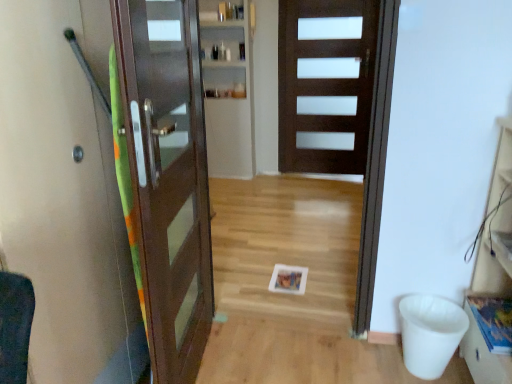
Question: Can you confirm if dark wood door at center, arranged as the 2th door when viewed from the left, is bigger than matte brown door at left, which is the 2th door in right-to-left order?

Choices:
 (A) yes
 (B) no

Answer: (A)

Question: Is dark wood door at center, positioned as the 1th door in right-to-left order, looking in the opposite direction of matte brown door at left, placed as the 1th door when sorted from left to right?

Choices:
 (A) yes
 (B) no

Answer: (B)

Question: Is matte brown door at left, placed as the second door when sorted from back to front, a part of dark wood door at center, positioned as the 1th door in right-to-left order?

Choices:
 (A) yes
 (B) no

Answer: (B)

Question: Can you confirm if dark wood door at center, arranged as the 2th door when viewed from the left, is taller than matte brown door at left, placed as the 1th door when sorted from left to right?

Choices:
 (A) yes
 (B) no

Answer: (A)

Question: Is dark wood door at center, positioned as the 1th door in right-to-left order, not inside matte brown door at left, which is counted as the first door, starting from the front?

Choices:
 (A) no
 (B) yes

Answer: (B)

Question: From their relative heights in the image, would you say dark wood door at center, acting as the first door starting from the back, is taller or shorter than green fabric elevator at left?

Choices:
 (A) tall
 (B) short

Answer: (A)

Question: From the image's perspective, relative to green fabric elevator at left, is dark wood door at center, arranged as the 2th door when viewed from the left, above or below?

Choices:
 (A) above
 (B) below

Answer: (A)

Question: From a real-world perspective, is dark wood door at center, placed as the 2th door when sorted from front to back, physically located above or below green fabric elevator at left?

Choices:
 (A) above
 (B) below

Answer: (A)

Question: Is dark wood door at center, placed as the 2th door when sorted from front to back, situated inside green fabric elevator at left or outside?

Choices:
 (A) outside
 (B) inside

Answer: (A)

Question: Relative to dark wood door at center, arranged as the 2th door when viewed from the left, is matte brown door at left, which is the 2th door in right-to-left order, in front or behind?

Choices:
 (A) front
 (B) behind

Answer: (A)

Question: From the image's perspective, is matte brown door at left, which is counted as the first door, starting from the front, above or below dark wood door at center, placed as the 2th door when sorted from front to back?

Choices:
 (A) above
 (B) below

Answer: (B)

Question: In terms of size, does matte brown door at left, which is counted as the first door, starting from the front, appear bigger or smaller than dark wood door at center, placed as the 2th door when sorted from front to back?

Choices:
 (A) big
 (B) small

Answer: (B)

Question: From a real-world perspective, is matte brown door at left, placed as the second door when sorted from back to front, positioned above or below dark wood door at center, positioned as the 1th door in right-to-left order?

Choices:
 (A) below
 (B) above

Answer: (A)

Question: Is point (96, 99) positioned closer to the camera than point (185, 319)?

Choices:
 (A) closer
 (B) farther

Answer: (A)

Question: From the image's perspective, is green fabric elevator at left positioned above or below matte brown door at left, which is counted as the first door, starting from the front?

Choices:
 (A) below
 (B) above

Answer: (A)